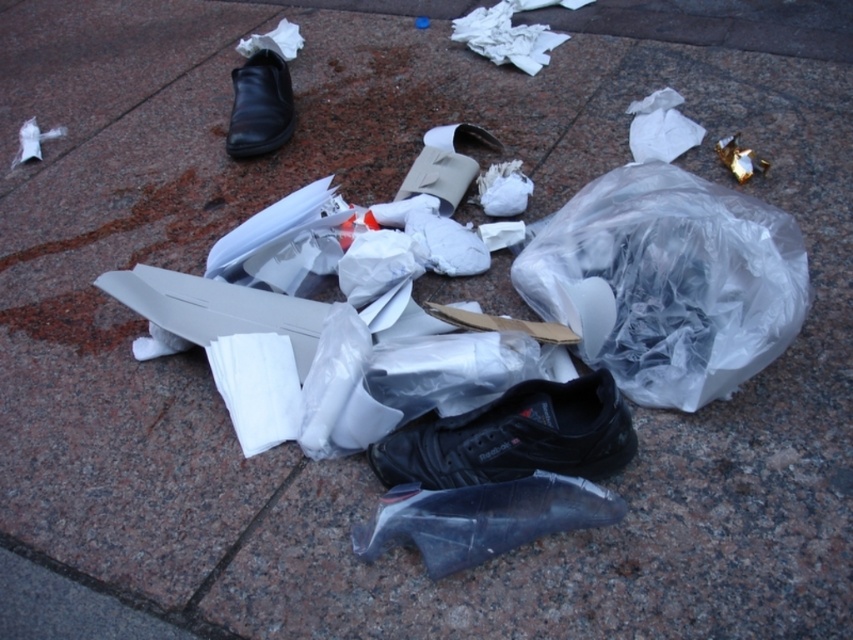
Question: Does transparent plastic bag at center appear over black leather shoe at upper left?

Choices:
 (A) yes
 (B) no

Answer: (B)

Question: Which object is closer to the camera taking this photo?

Choices:
 (A) black matte shoe at center
 (B) transparent plastic shoe at center

Answer: (A)

Question: Can you confirm if transparent plastic bag at center is thinner than black leather shoe at upper left?

Choices:
 (A) yes
 (B) no

Answer: (B)

Question: Among these objects, which one is nearest to the camera?

Choices:
 (A) black leather shoe at upper left
 (B) transparent plastic shoe at center

Answer: (B)

Question: Does black matte shoe at center appear on the left side of transparent plastic shoe at center?

Choices:
 (A) yes
 (B) no

Answer: (B)

Question: Which of the following is the farthest from the observer?

Choices:
 (A) click(263, 122)
 (B) click(799, 323)
 (C) click(489, 433)
 (D) click(383, 509)

Answer: (A)